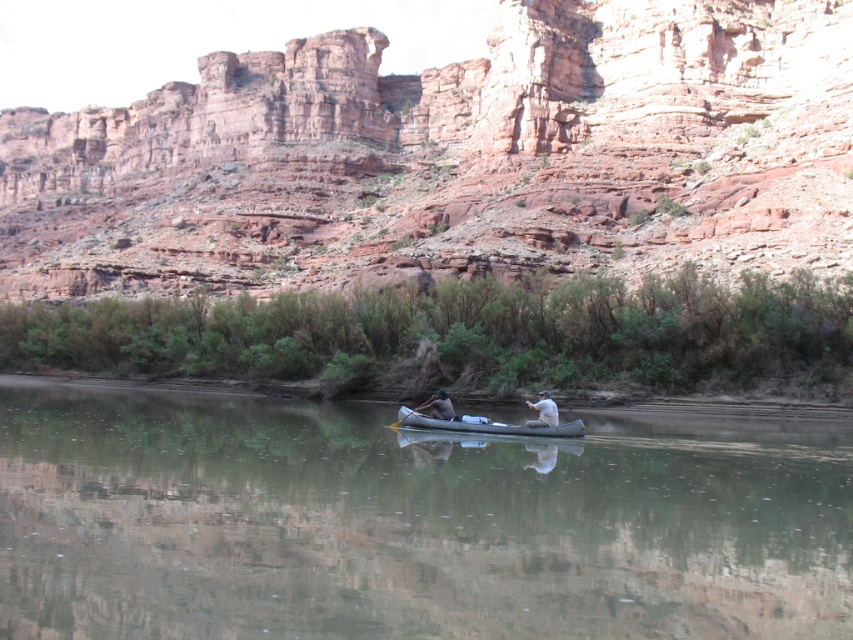
You are standing on the riverbank and see the canoe with two people in it. Which object in the canoe is bigger, the clear water at center or the white cotton shirt at center?

The clear water at center is larger in size than the white cotton shirt at center.

You are in a canoe on a calm body of water with two people. You notice a point marked at coordinates (410, 522). What is located at that point?

At point (410, 522) lies clear water at center.